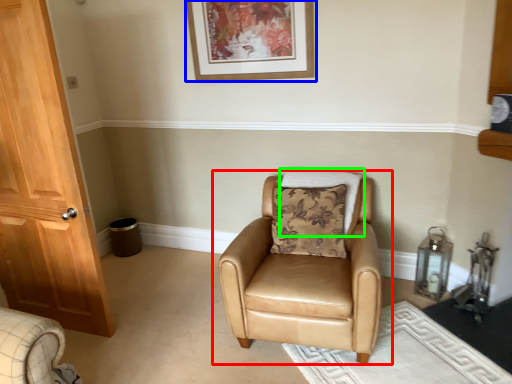
Question: Considering the real-world distances, which object is closest to chair (highlighted by a red box)? picture frame (highlighted by a blue box) or pillow (highlighted by a green box).

Choices:
 (A) picture frame
 (B) pillow

Answer: (B)